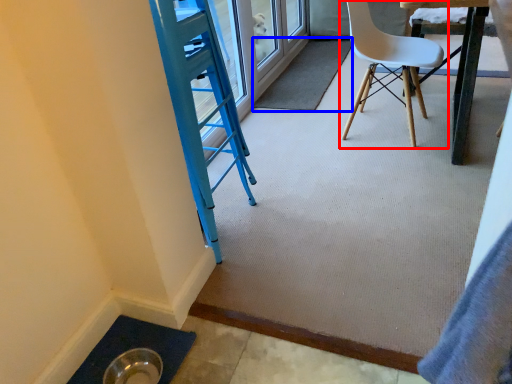
Question: Which object is further to the camera taking this photo, chair (highlighted by a red box) or mat (highlighted by a blue box)?

Choices:
 (A) chair
 (B) mat

Answer: (B)